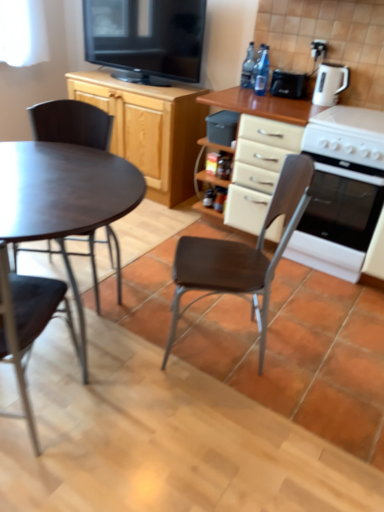
Question: Would you consider wooden cabinet at upper left to be distant from black plastic container at center, placed as the second appliance when sorted from top to bottom?

Choices:
 (A) no
 (B) yes

Answer: (A)

Question: Is wooden cabinet at upper left further to camera compared to black plastic container at center, placed as the 1th appliance when sorted from bottom to top?

Choices:
 (A) yes
 (B) no

Answer: (A)

Question: Considering the relative positions of wooden cabinet at upper left and black plastic container at center, the second appliance when ordered from right to left, in the image provided, is wooden cabinet at upper left to the right of black plastic container at center, the second appliance when ordered from right to left, from the viewer's perspective?

Choices:
 (A) yes
 (B) no

Answer: (B)

Question: Is wooden cabinet at upper left next to black plastic container at center, placed as the second appliance when sorted from top to bottom?

Choices:
 (A) yes
 (B) no

Answer: (B)

Question: Does wooden cabinet at upper left appear on the left side of black plastic container at center, placed as the second appliance when sorted from top to bottom?

Choices:
 (A) no
 (B) yes

Answer: (B)

Question: Based on their sizes in the image, would you say wooden cabinet at upper left is bigger or smaller than white glossy oven at right?

Choices:
 (A) big
 (B) small

Answer: (A)

Question: In the image, is wooden cabinet at upper left positioned in front of or behind white glossy oven at right?

Choices:
 (A) behind
 (B) front

Answer: (A)

Question: From the image's perspective, is wooden cabinet at upper left located above or below white glossy oven at right?

Choices:
 (A) below
 (B) above

Answer: (B)

Question: From a real-world perspective, relative to white glossy oven at right, is wooden cabinet at upper left vertically above or below?

Choices:
 (A) above
 (B) below

Answer: (A)

Question: From the image's perspective, relative to black plastic container at center, placed as the 1th appliance when sorted from bottom to top, is black plastic toaster at upper right, which is counted as the second appliance, starting from the left, above or below?

Choices:
 (A) below
 (B) above

Answer: (B)

Question: Considering the positions of black plastic toaster at upper right, placed as the 1th appliance when sorted from top to bottom, and black plastic container at center, placed as the second appliance when sorted from top to bottom, in the image, is black plastic toaster at upper right, placed as the 1th appliance when sorted from top to bottom, bigger or smaller than black plastic container at center, placed as the second appliance when sorted from top to bottom,?

Choices:
 (A) small
 (B) big

Answer: (A)

Question: Considering the relative positions of black plastic toaster at upper right, which appears as the 1th appliance when viewed from the right, and black plastic container at center, the second appliance when ordered from right to left, in the image provided, is black plastic toaster at upper right, which appears as the 1th appliance when viewed from the right, to the left or to the right of black plastic container at center, the second appliance when ordered from right to left,?

Choices:
 (A) right
 (B) left

Answer: (A)

Question: In the image, is black plastic toaster at upper right, which appears as the 1th appliance when viewed from the right, positioned in front of or behind black plastic container at center, placed as the 1th appliance when sorted from bottom to top?

Choices:
 (A) front
 (B) behind

Answer: (B)

Question: Considering the relative positions of black glossy television at upper center and white glossy electric kettle at upper right in the image provided, is black glossy television at upper center to the left or to the right of white glossy electric kettle at upper right?

Choices:
 (A) left
 (B) right

Answer: (A)

Question: Is black glossy television at upper center inside or outside of white glossy electric kettle at upper right?

Choices:
 (A) inside
 (B) outside

Answer: (B)